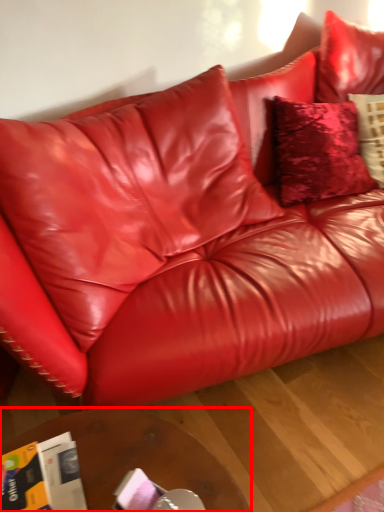
Question: From the image's perspective, what is the correct spatial positioning of table (annotated by the red box) in reference to magazine?

Choices:
 (A) above
 (B) below

Answer: (B)